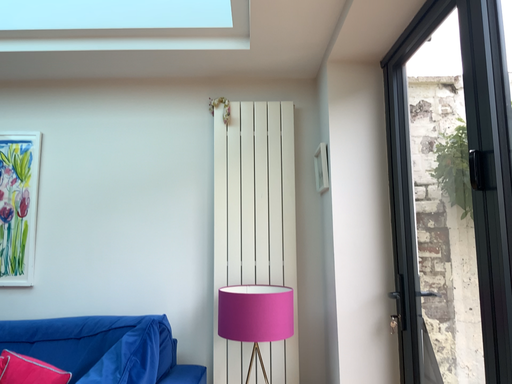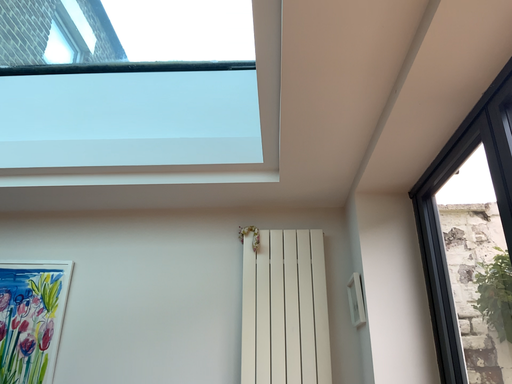
Question: Which way did the camera rotate in the video?

Choices:
 (A) rotated upward
 (B) rotated downward

Answer: (A)